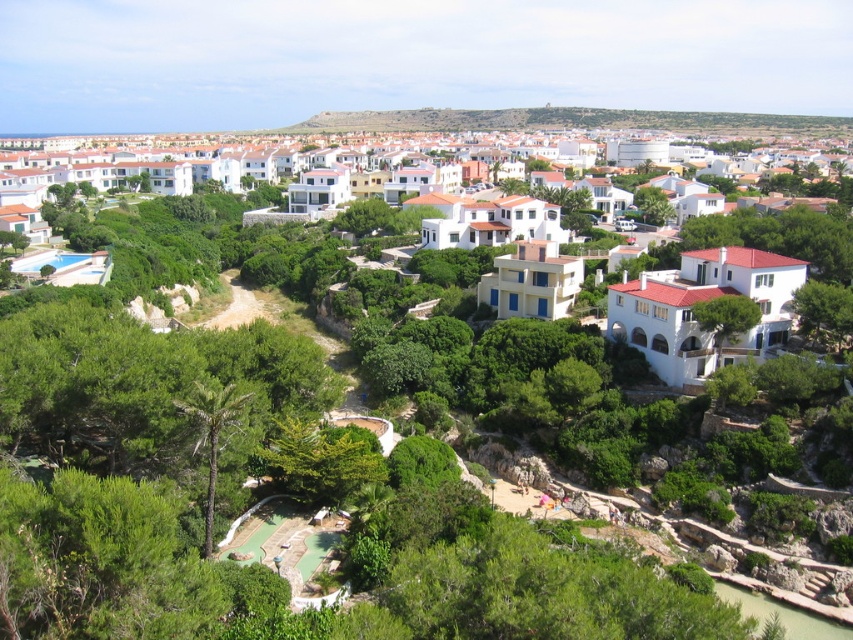
Does white matte houses at center appear on the left side of green leafy palm at lower left?

Incorrect, white matte houses at center is not on the left side of green leafy palm at lower left.

Does white matte houses at center have a smaller size compared to green leafy palm at lower left?

Incorrect, white matte houses at center is not smaller in size than green leafy palm at lower left.

Which is behind, point (138, 172) or point (206, 545)?

Point (138, 172)

Locate an element on the screen. This screenshot has width=853, height=640. white matte houses at center is located at coordinates (724, 291).

Who is more distant from viewer, (x=374, y=442) or (x=726, y=316)?

Point (x=726, y=316)

The height and width of the screenshot is (640, 853). What do you see at coordinates (322, 460) in the screenshot? I see `green leafy tree at center` at bounding box center [322, 460].

Locate an element on the screen. This screenshot has height=640, width=853. green leafy tree at center is located at coordinates (322, 460).

Is green leafy tree at center to the right of green leafy palm at lower left from the viewer's perspective?

Indeed, green leafy tree at center is positioned on the right side of green leafy palm at lower left.

From the picture: Is green leafy tree at center smaller than green leafy palm at lower left?

Incorrect, green leafy tree at center is not smaller in size than green leafy palm at lower left.

Measure the distance between green leafy tree at center and camera.

They are 223.08 feet apart.

The height and width of the screenshot is (640, 853). I want to click on green leafy tree at center, so click(x=322, y=460).